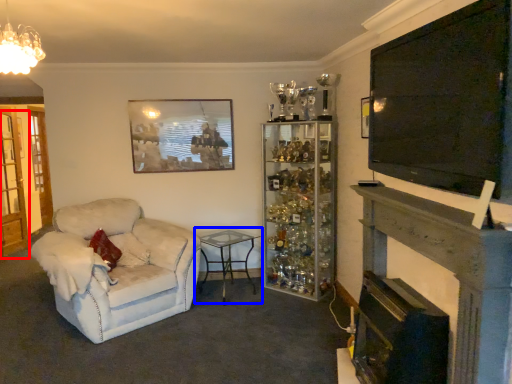
Question: Which of the following is the farthest to the observer, glass door (highlighted by a red box) or table (highlighted by a blue box)?

Choices:
 (A) glass door
 (B) table

Answer: (A)